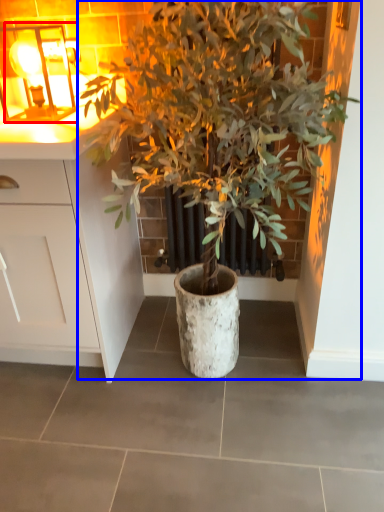
Question: Which point is further to the camera, light fixture (highlighted by a red box) or houseplant (highlighted by a blue box)?

Choices:
 (A) light fixture
 (B) houseplant

Answer: (A)